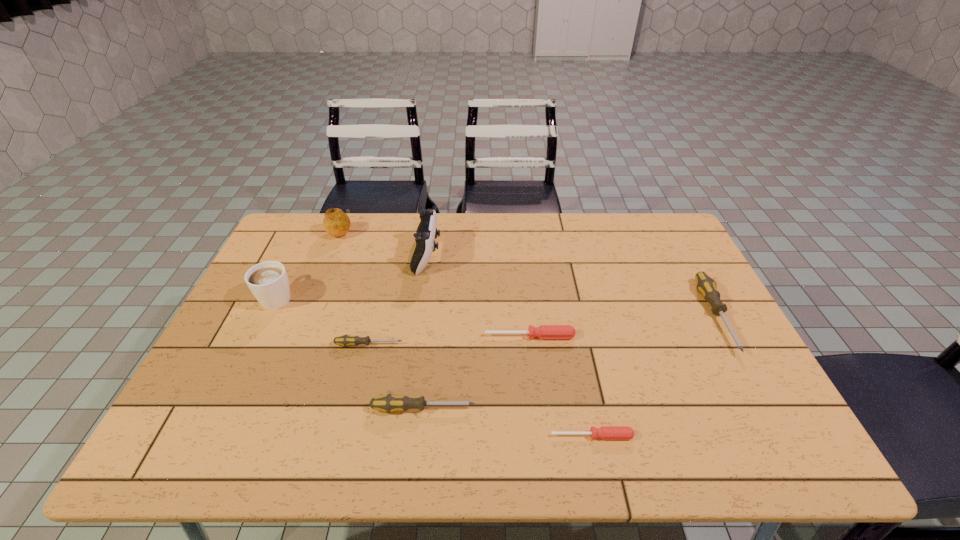
The image size is (960, 540). I want to click on the nearest screwdriver, so click(x=605, y=432).

The height and width of the screenshot is (540, 960). Identify the location of the shortest object. (605, 432).

Find the location of a particular element. free space located on the front-facing side of the control is located at coordinates pyautogui.click(x=498, y=256).

Locate an element on the screen. This screenshot has height=540, width=960. vacant space located 0.100m on the front of the pear is located at coordinates (329, 260).

This screenshot has height=540, width=960. I want to click on free space located with the handle on the side of the leftmost object, so click(x=317, y=218).

Image resolution: width=960 pixels, height=540 pixels. Find the location of `vacant position located 0.210m with the handle on the side of the leftmost object`. vacant position located 0.210m with the handle on the side of the leftmost object is located at coordinates (306, 239).

At what (x,y) coordinates should I click in order to perform the action: click on vacant region located with the handle on the side of the leftmost object. Please return your answer as a coordinate pair (x, y). Looking at the image, I should click on (315, 221).

Where is `vacant region located at the tip of the rightmost gray screwdriver`? The image size is (960, 540). vacant region located at the tip of the rightmost gray screwdriver is located at coordinates (790, 453).

Find the location of `free location located at the tip of the second tallest screwdriver`. free location located at the tip of the second tallest screwdriver is located at coordinates (630, 408).

Identify the location of vacant space situated on the left of the bigger red screwdriver. (411, 336).